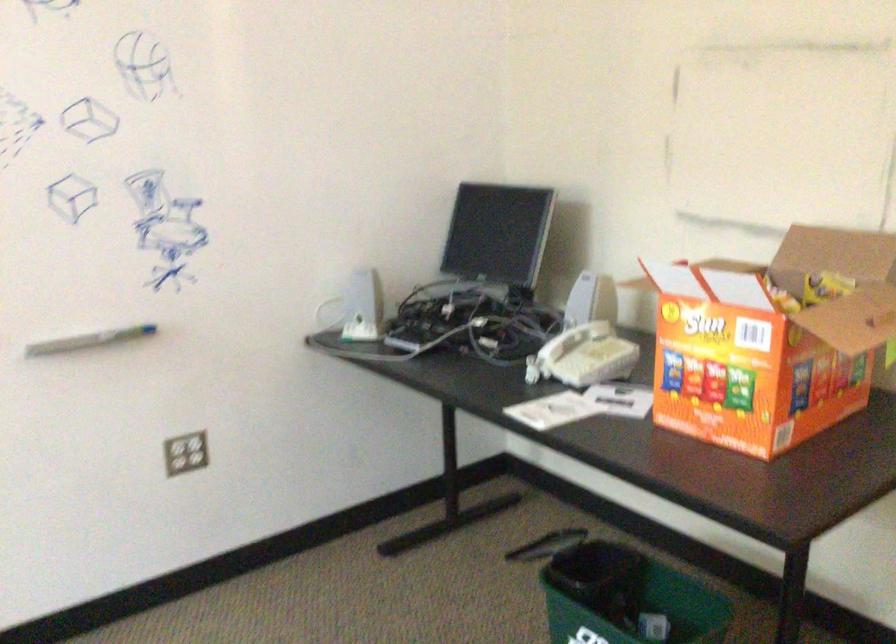
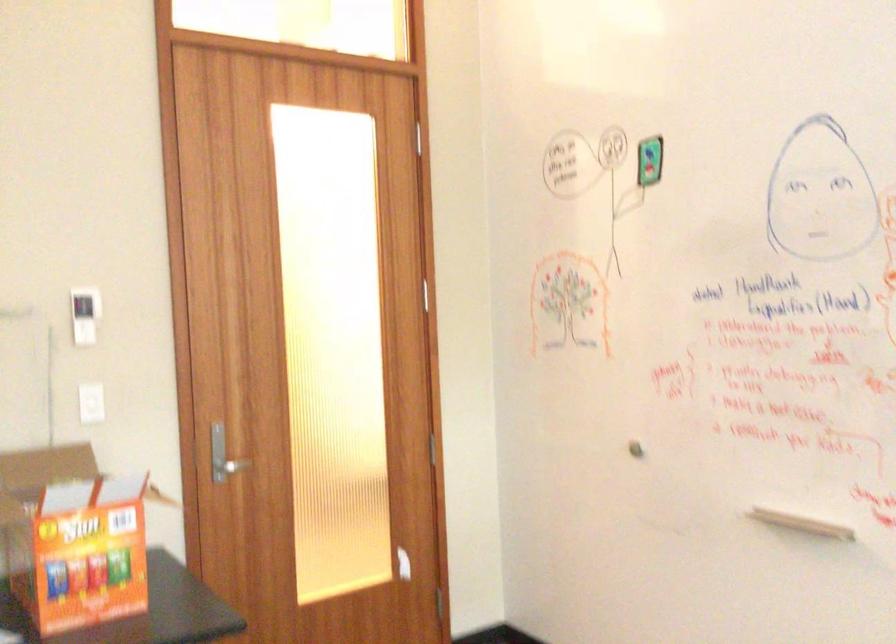
Find the pixel in the second image that matches pixel 695 335 in the first image.

(72, 538)